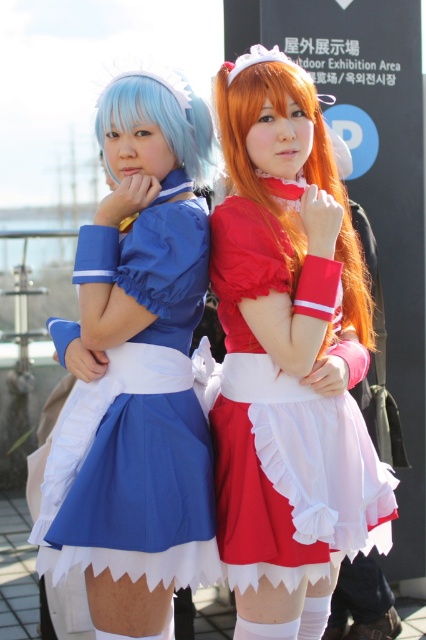
Question: Does matte red dress at center appear on the left side of shiny orange wig at center?

Choices:
 (A) yes
 (B) no

Answer: (A)

Question: In this image, where is matte red dress at center located relative to matte blue wig at upper left?

Choices:
 (A) right
 (B) left

Answer: (A)

Question: Which object is farther from the camera taking this photo?

Choices:
 (A) matte red dress at center
 (B) matte blue fabric dress at left
 (C) matte blue wig at upper left
 (D) shiny orange wig at center

Answer: (C)

Question: Where is matte blue fabric dress at left located in relation to shiny orange wig at center in the image?

Choices:
 (A) below
 (B) above

Answer: (A)

Question: Which object is the closest to the matte red dress at center?

Choices:
 (A) matte blue wig at upper left
 (B) matte blue fabric dress at left

Answer: (B)

Question: Among these points, which one is nearest to the camera?

Choices:
 (A) (169, 186)
 (B) (305, 100)
 (C) (187, 88)

Answer: (B)